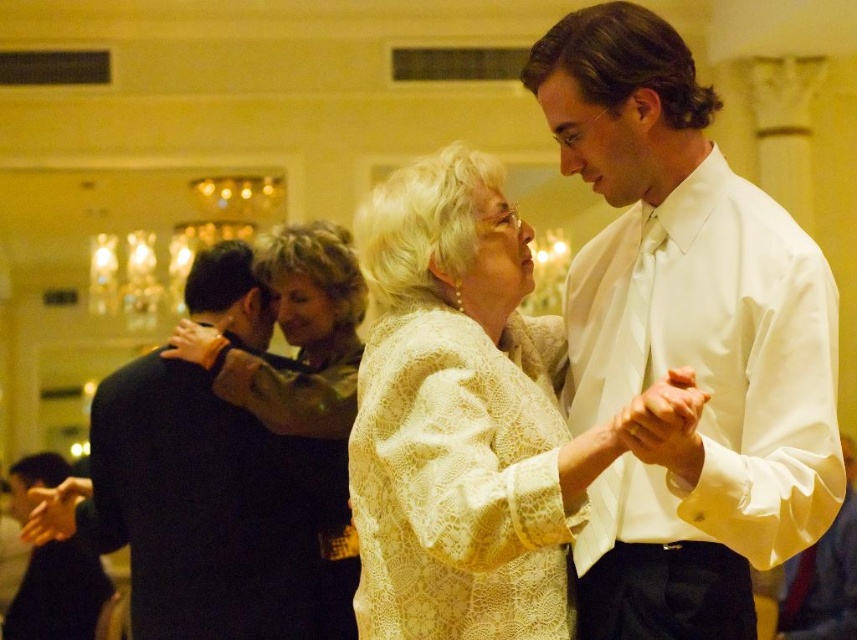
Is point (291, 598) less distant than point (171, 349)?

No, (291, 598) is behind (171, 349).

Is point (190, 528) farther from viewer compared to point (310, 305)?

No, (190, 528) is in front of (310, 305).

Locate an element on the screen. dark brown wool robe at left is located at coordinates (196, 508).

Between point (345, 371) and point (27, 481), which one is positioned behind?

The point (27, 481) is more distant.

Which is in front, point (333, 452) or point (58, 602)?

Point (333, 452) is more forward.

Who is more distant from viewer, (x=357, y=570) or (x=1, y=634)?

Point (x=1, y=634)

You are a GUI agent. You are given a task and a screenshot of the screen. Output one action in this format:
    pyautogui.click(x=<x>, y=<y>)
    Task: Click on the light brown lace blouse at center
    The width and height of the screenshot is (857, 640).
    Given the screenshot: What is the action you would take?
    pyautogui.click(x=303, y=387)

Between lacy beige dress at center and dark brown wool robe at left, which one is positioned lower?

dark brown wool robe at left

Looking at this image, is lacy beige dress at center to the left of dark brown wool robe at left from the viewer's perspective?

In fact, lacy beige dress at center is to the right of dark brown wool robe at left.

Locate an element on the screen. This screenshot has height=640, width=857. lacy beige dress at center is located at coordinates (460, 481).

This screenshot has width=857, height=640. Identify the location of lacy beige dress at center. (460, 481).